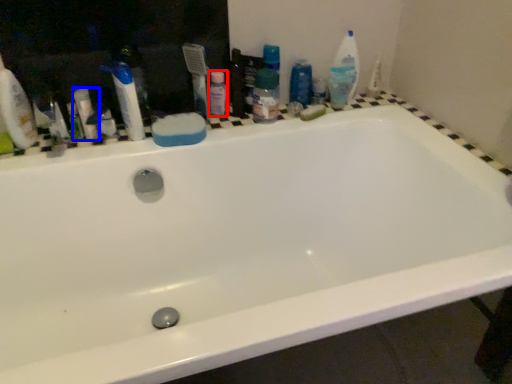
Question: Among these objects, which one is nearest to the camera, toiletry (highlighted by a red box) or toiletry (highlighted by a blue box)?

Choices:
 (A) toiletry
 (B) toiletry

Answer: (B)